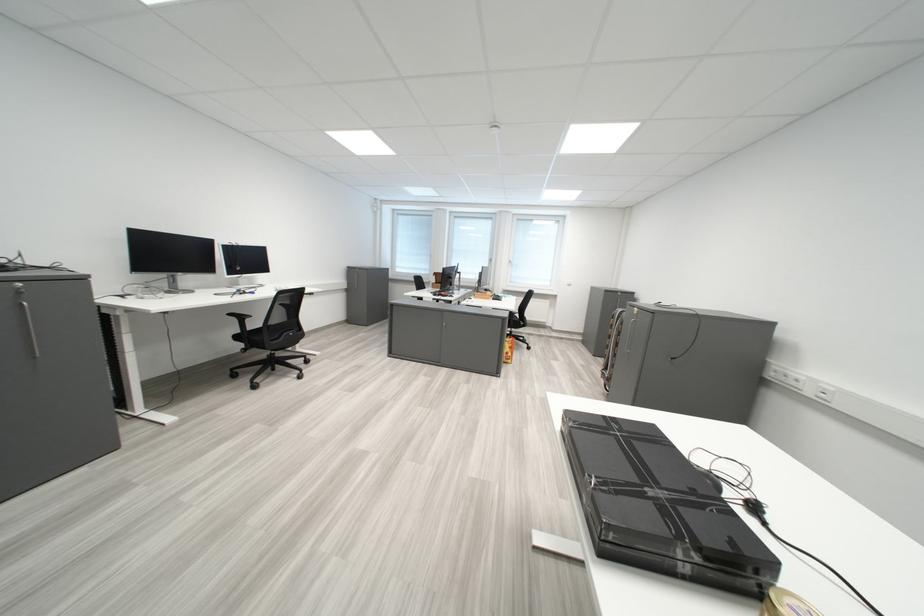
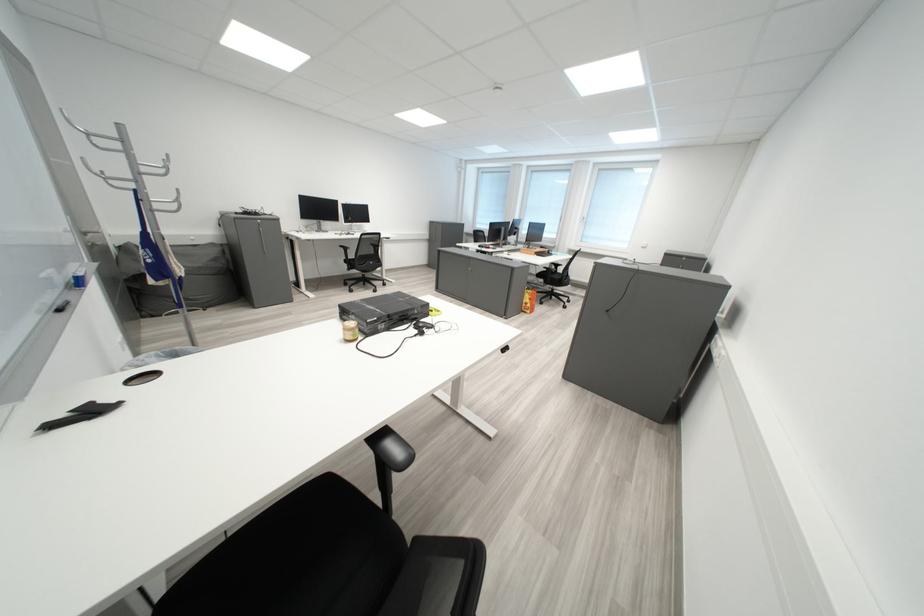
Locate, in the second image, the point that corresponds to (527,331) in the first image.

(567, 290)